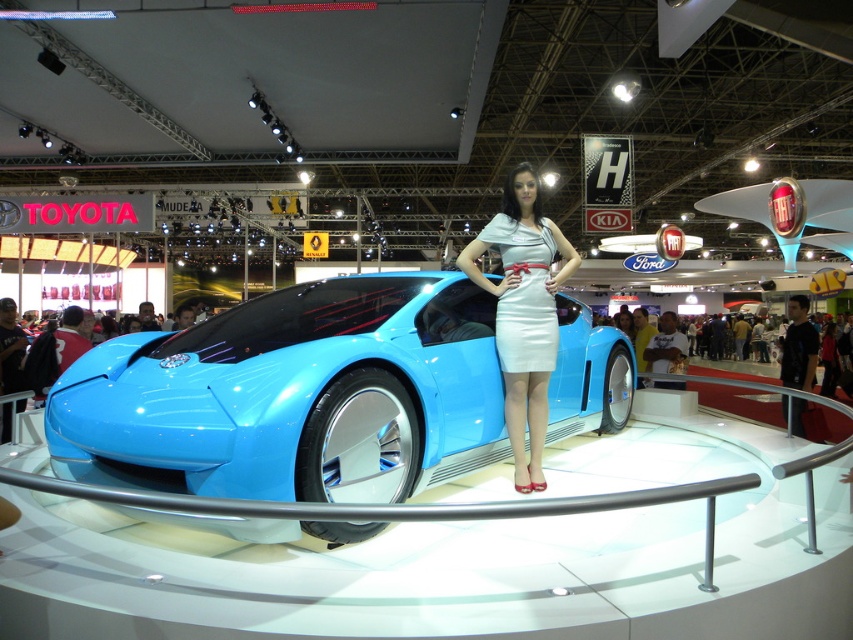
Which is more to the left, glossy blue car at center or white satin dress at center?

glossy blue car at center is more to the left.

Is glossy blue car at center wider than white satin dress at center?

Indeed, glossy blue car at center has a greater width compared to white satin dress at center.

Measure the distance between point [480,326] and camera.

A distance of 12.08 feet exists between point [480,326] and camera.

Locate an element on the screen. glossy blue car at center is located at coordinates (294, 396).